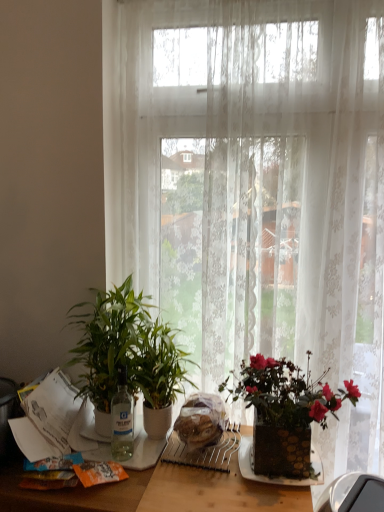
The width and height of the screenshot is (384, 512). In order to click on blank space situated above wooden table at center (from a real-world perspective) in this screenshot , I will do `click(170, 459)`.